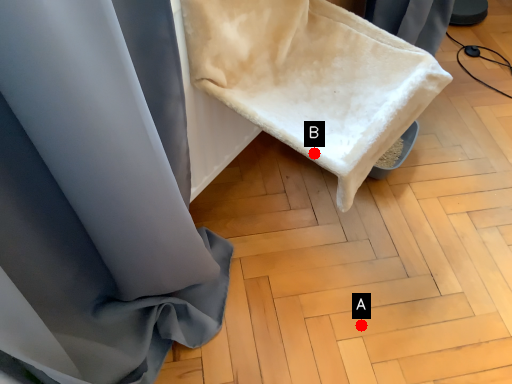
Question: Two points are circled on the image, labeled by A and B beside each circle. Among these points, which one is nearest to the camera?

Choices:
 (A) A is closer
 (B) B is closer

Answer: (B)